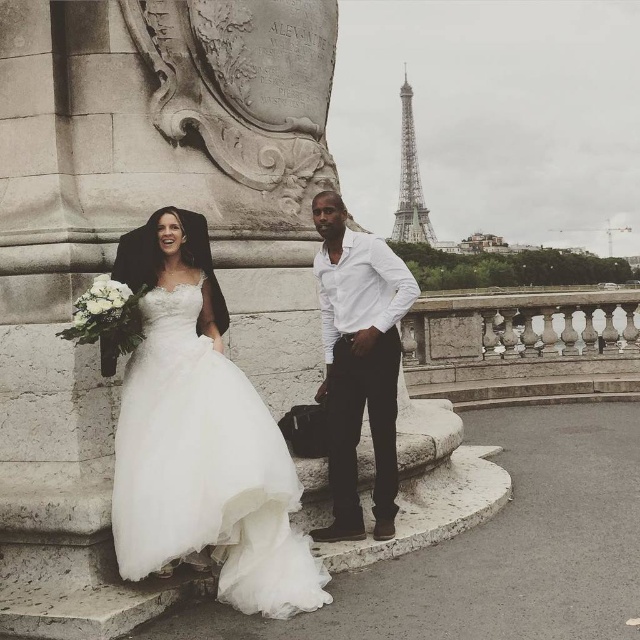
You are a photographer planning to capture a photo of the white smooth shirt at center and the metallic silver eiffel tower at upper right. Which object should you focus on first if you want to ensure both are in sharp focus?

You should focus on the metallic silver eiffel tower at upper right first because it occupies more space in the image than the white smooth shirt at center, ensuring both are in sharp focus.

You are a photographer planning to take a group photo of the two people in the scene. The white tulle dress at left and the white smooth shirt at center are both white. To ensure both are visible in the photo, which clothing item should you focus on first?

The white tulle dress at left occupies less space than the white smooth shirt at center, so focusing on the white smooth shirt at center first would ensure its visibility before adjusting for the smaller area of the white tulle dress at left.

Based on the scene in Paris with the white tulle dress at left and the metallic silver eiffel tower at upper right, which object is shorter?

The white tulle dress at left is shorter than the metallic silver eiffel tower at upper right.